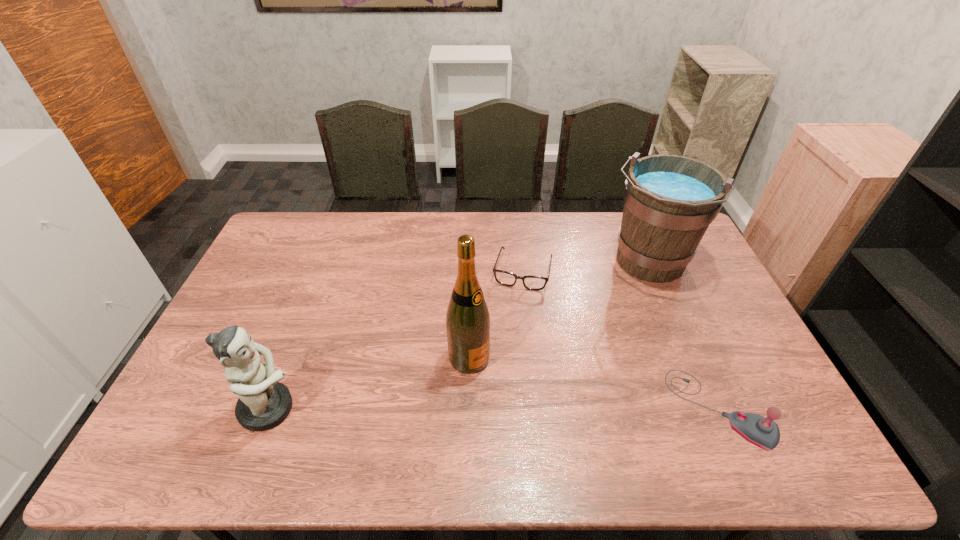
I want to click on free area in between the fourth shortest object and the fourth object from right to left, so click(x=558, y=311).

At what (x,y) coordinates should I click in order to perform the action: click on free space between the wine bucket and the joystick. Please return your answer as a coordinate pair (x, y). Looking at the image, I should click on (684, 336).

The height and width of the screenshot is (540, 960). In order to click on unoccupied area between the second object from left to right and the second tallest object in this screenshot , I will do `click(558, 311)`.

What are the coordinates of `vacant space that's between the third object from right to left and the wine bucket` in the screenshot? It's located at (585, 267).

Locate an element on the screen. This screenshot has height=540, width=960. free point between the fourth object from right to left and the second shortest object is located at coordinates (594, 383).

The image size is (960, 540). I want to click on vacant space that's between the second object from left to right and the second tallest object, so click(x=558, y=311).

Locate an element on the screen. This screenshot has width=960, height=540. free space between the second shortest object and the fourth shortest object is located at coordinates (684, 336).

The height and width of the screenshot is (540, 960). I want to click on object that is the closest one to the wine bucket, so click(505, 278).

Select which object appears as the third closest to the wine bottle. Please provide its 2D coordinates. Your answer should be formatted as a tuple, i.e. [(x, y)], where the tuple contains the x and y coordinates of a point satisfying the conditions above.

[(669, 200)]